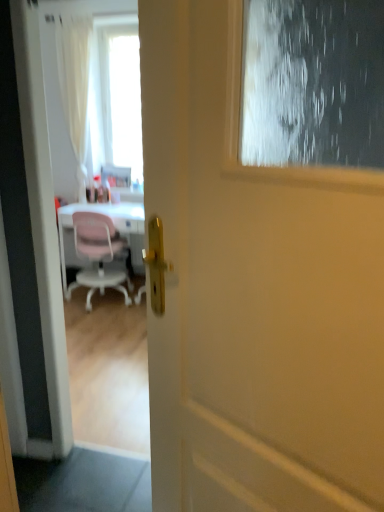
Question: From the image's perspective, is transparent glass screen door at upper center positioned above or below white matte door at center?

Choices:
 (A) above
 (B) below

Answer: (A)

Question: Is transparent glass screen door at upper center wider or thinner than white matte door at center?

Choices:
 (A) thin
 (B) wide

Answer: (B)

Question: Which is farther from the white matte door at center?

Choices:
 (A) pink plastic chair at left
 (B) transparent glass screen door at upper center

Answer: (A)

Question: Based on their relative distances, which object is farther from the white matte door at center?

Choices:
 (A) transparent glass screen door at upper center
 (B) pink plastic chair at left

Answer: (B)